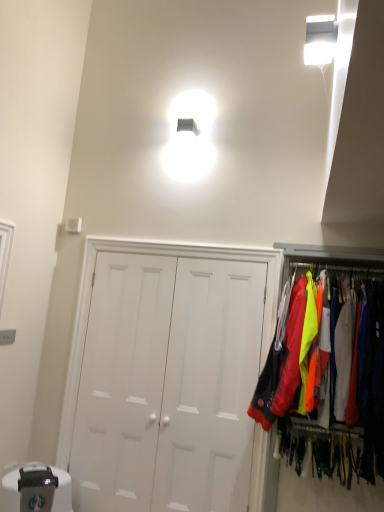
Question: Considering the relative sizes of white matte door at center and neon fabric jackets at right in the image provided, is white matte door at center thinner than neon fabric jackets at right?

Choices:
 (A) yes
 (B) no

Answer: (A)

Question: Is white matte door at center not inside neon fabric jackets at right?

Choices:
 (A) yes
 (B) no

Answer: (A)

Question: From the image's perspective, is white matte door at center beneath neon fabric jackets at right?

Choices:
 (A) yes
 (B) no

Answer: (A)

Question: Is white matte door at center to the right of neon fabric jackets at right from the viewer's perspective?

Choices:
 (A) no
 (B) yes

Answer: (A)

Question: Is white matte door at center oriented towards neon fabric jackets at right?

Choices:
 (A) yes
 (B) no

Answer: (B)

Question: Is white matte door at center far away from neon fabric jackets at right?

Choices:
 (A) no
 (B) yes

Answer: (A)

Question: From a real-world perspective, is neon fabric jackets at right below white matte door at center?

Choices:
 (A) no
 (B) yes

Answer: (A)

Question: Is neon fabric jackets at right further to camera compared to white matte door at center?

Choices:
 (A) no
 (B) yes

Answer: (A)

Question: Is neon fabric jackets at right smaller than white matte door at center?

Choices:
 (A) yes
 (B) no

Answer: (B)

Question: From the image's perspective, would you say neon fabric jackets at right is shown under white matte door at center?

Choices:
 (A) no
 (B) yes

Answer: (A)

Question: Is neon fabric jackets at right facing away from white matte door at center?

Choices:
 (A) no
 (B) yes

Answer: (A)

Question: Is neon fabric jackets at right in front of white matte door at center?

Choices:
 (A) yes
 (B) no

Answer: (A)

Question: Considering their positions, is white matte door at center located in front of or behind neon fabric jackets at right?

Choices:
 (A) behind
 (B) front

Answer: (A)